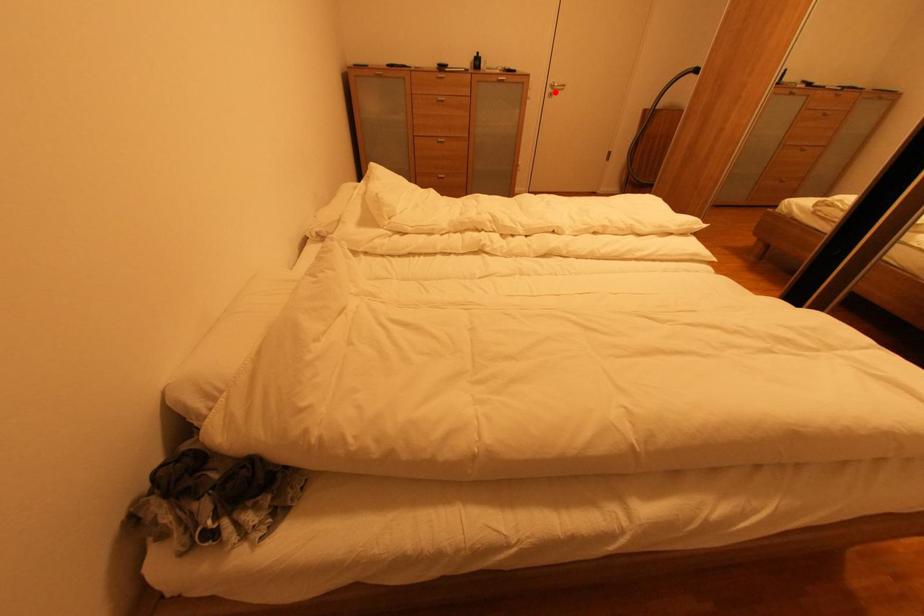
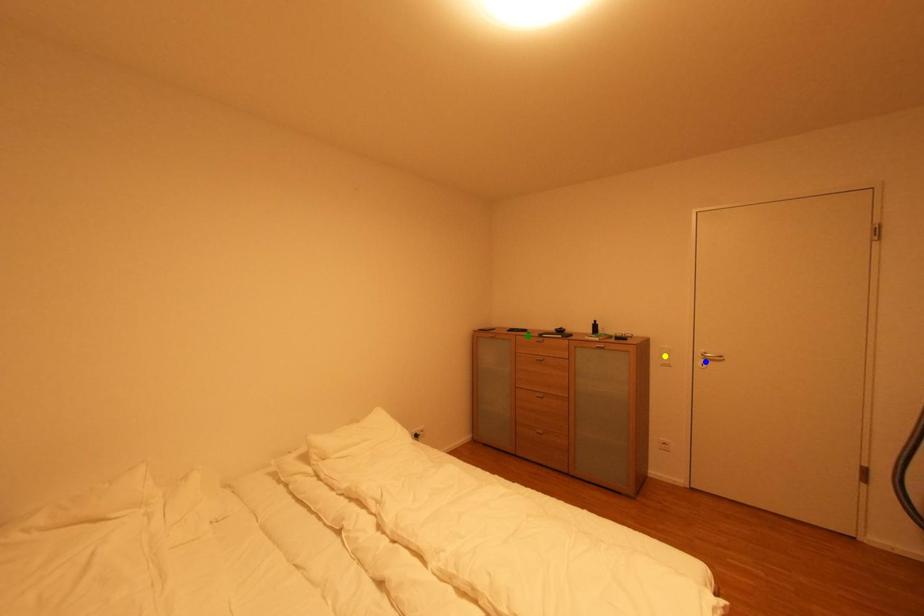
Question: I am providing you with two images of the same scene from different viewpoints. A red point is marked on the first image. You are given multiple points on the second image. Which mark in image 2 goes with the point in image 1?

Choices:
 (A) yellow point
 (B) blue point
 (C) green point

Answer: (B)